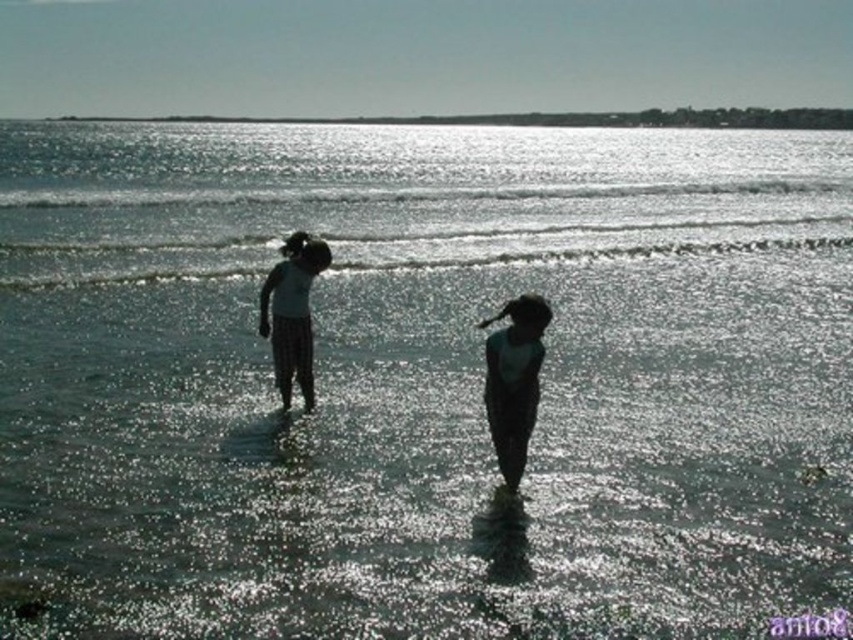
You are a photographer trying to capture a photo of the two figures wearing the matte green shirt at center and the matte white shirt at center. Based on their positions, which one is closer to the camera?

The matte green shirt at center is below the matte white shirt at center, so the matte white shirt at center is closer to the camera.

You are a photographer trying to capture the two figures in the beach scene. You notice their shirts are labeled as matte green shirt at center and matte white shirt at center. Which shirt is positioned more to the left side of the image?

The matte white shirt at center is positioned more to the left side of the image because the matte green shirt at center is to the right of it.

You are a photographer trying to capture the two children in the water. The matte green shirt at center is located at point (514, 380). Where should you position your camera to ensure the matte green shirt at center is centered in your shot?

To center the matte green shirt at center in your shot, position your camera directly aligned with the coordinates point (514, 380).